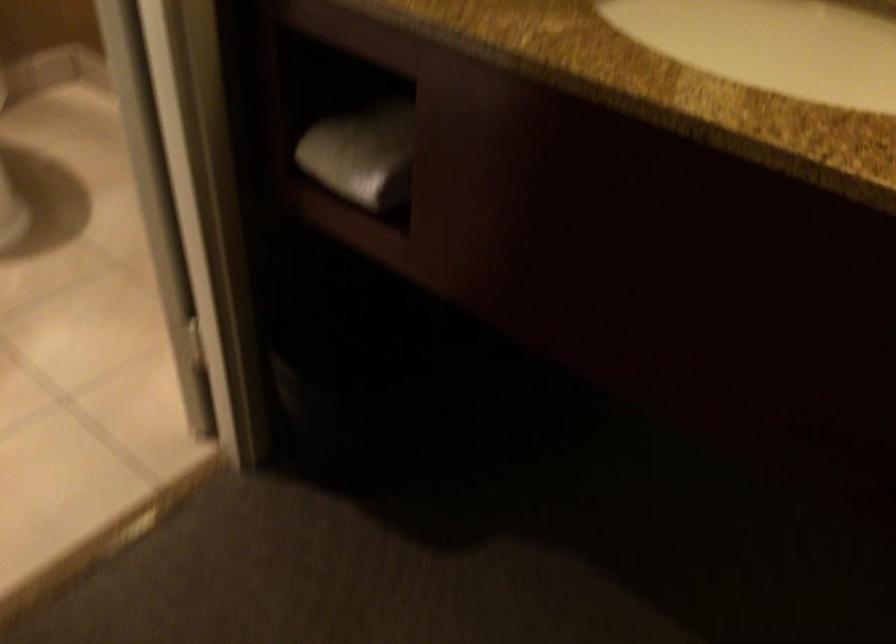
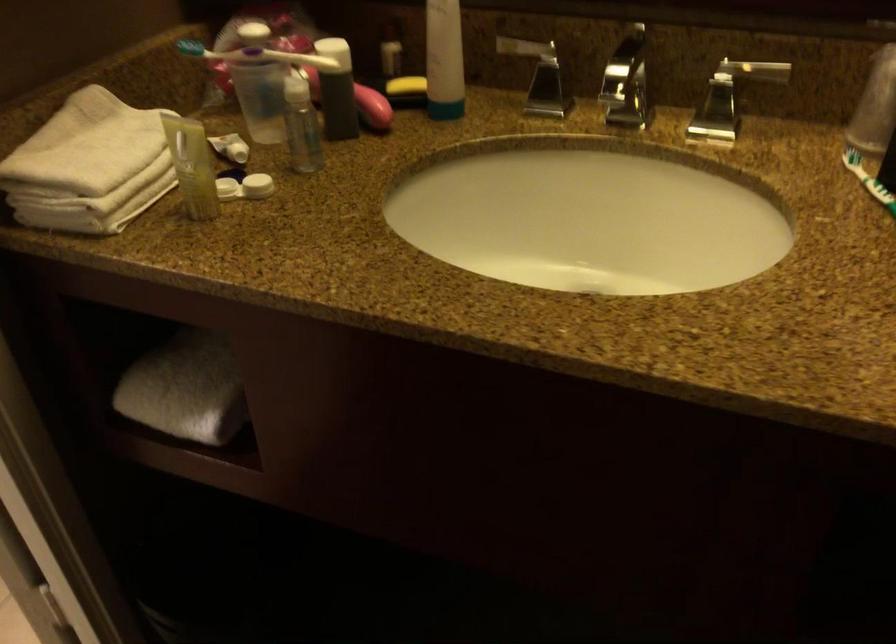
The images are taken continuously from a first-person perspective. In which direction are you moving?

The cameraman walked toward right, forward.